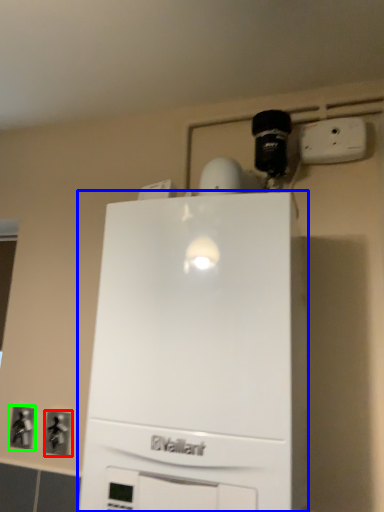
Question: Which is farther away from electric outlet (highlighted by a red box)? home appliance (highlighted by a blue box) or electric outlet (highlighted by a green box)?

Choices:
 (A) home appliance
 (B) electric outlet

Answer: (A)